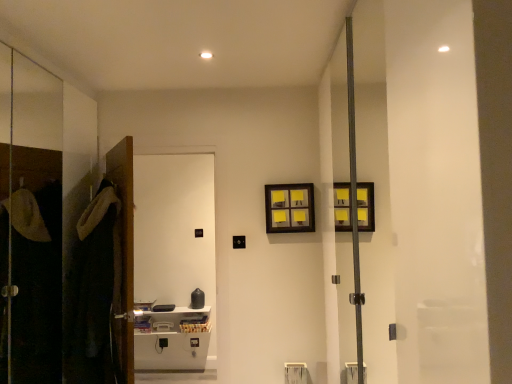
Question: Considering the relative positions of wooden picture frame at upper center and white glossy cabinet at left in the image provided, is wooden picture frame at upper center to the left of white glossy cabinet at left from the viewer's perspective?

Choices:
 (A) yes
 (B) no

Answer: (B)

Question: Can you confirm if wooden picture frame at upper center is bigger than white glossy cabinet at left?

Choices:
 (A) no
 (B) yes

Answer: (A)

Question: Considering the relative sizes of wooden picture frame at upper center and white glossy cabinet at left in the image provided, is wooden picture frame at upper center smaller than white glossy cabinet at left?

Choices:
 (A) yes
 (B) no

Answer: (A)

Question: Does wooden picture frame at upper center turn towards white glossy cabinet at left?

Choices:
 (A) yes
 (B) no

Answer: (B)

Question: Considering the relative sizes of wooden picture frame at upper center and white glossy cabinet at left in the image provided, is wooden picture frame at upper center shorter than white glossy cabinet at left?

Choices:
 (A) no
 (B) yes

Answer: (B)

Question: Considering the relative positions of wooden picture frame at upper center and white glossy cabinet at left in the image provided, is wooden picture frame at upper center in front of white glossy cabinet at left?

Choices:
 (A) no
 (B) yes

Answer: (A)

Question: Is dark brown plush robe at left to the left of white glossy cabinet at left from the viewer's perspective?

Choices:
 (A) no
 (B) yes

Answer: (B)

Question: Is dark brown plush robe at left not near white glossy cabinet at left?

Choices:
 (A) no
 (B) yes

Answer: (B)

Question: Does dark brown plush robe at left turn towards white glossy cabinet at left?

Choices:
 (A) yes
 (B) no

Answer: (B)

Question: Is the position of dark brown plush robe at left less distant than that of white glossy cabinet at left?

Choices:
 (A) no
 (B) yes

Answer: (B)

Question: From the image's perspective, is dark brown plush robe at left located beneath white glossy cabinet at left?

Choices:
 (A) yes
 (B) no

Answer: (A)

Question: Is dark brown plush robe at left next to white glossy cabinet at left and touching it?

Choices:
 (A) yes
 (B) no

Answer: (B)

Question: Is white glossy cabinet at left not inside wooden picture frame at upper center?

Choices:
 (A) no
 (B) yes

Answer: (B)